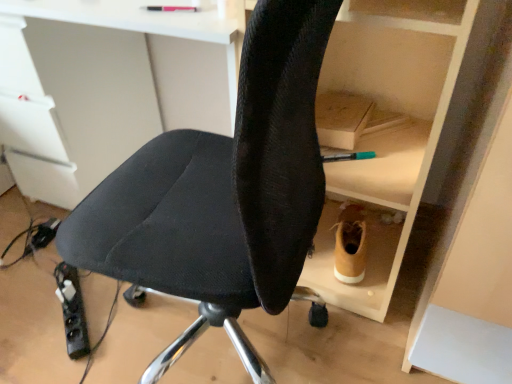
Question: From the image's perspective, is black fabric chair at center located above or below tan suede boot at lower right?

Choices:
 (A) above
 (B) below

Answer: (A)

Question: Is black fabric chair at center taller or shorter than tan suede boot at lower right?

Choices:
 (A) short
 (B) tall

Answer: (B)

Question: Considering the real-world distances, which object is farthest from the black plastic power strip at lower left?

Choices:
 (A) black fabric chair at center
 (B) tan suede boot at lower right

Answer: (B)

Question: Considering the real-world distances, which object is farthest from the tan suede boot at lower right?

Choices:
 (A) black plastic power strip at lower left
 (B) black fabric chair at center

Answer: (A)